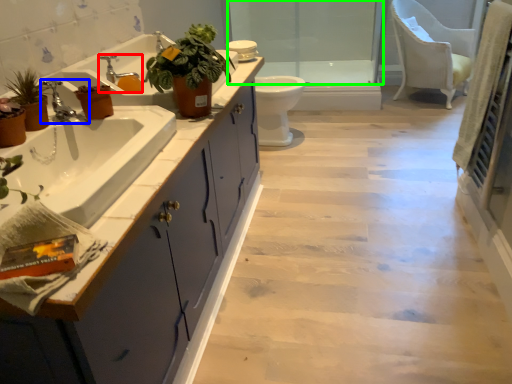
Question: Which is nearer to the tap (highlighted by a red box)? tap (highlighted by a blue box) or glass door (highlighted by a green box).

Choices:
 (A) tap
 (B) glass door

Answer: (A)